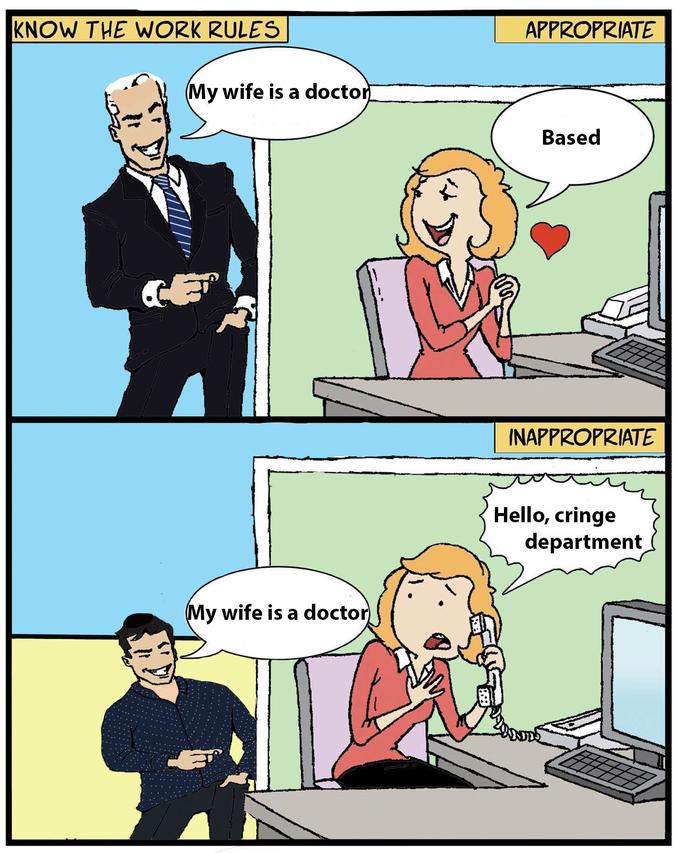
Locate an element on the screen. The width and height of the screenshot is (680, 853). landline phone is located at coordinates (547, 729), (609, 321).